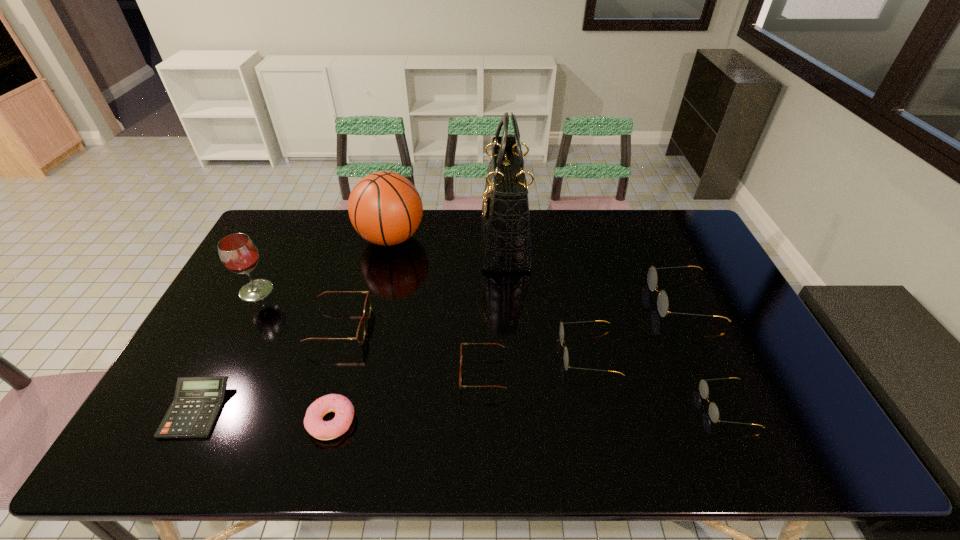
What are the coordinates of `handbag` in the screenshot? It's located at (505, 226).

Find the location of a particular element. the second tallest object is located at coordinates 385,208.

Where is `red wineglass`? This screenshot has height=540, width=960. red wineglass is located at coordinates (238, 253).

Where is `the third tallest object`? The width and height of the screenshot is (960, 540). the third tallest object is located at coordinates (238, 253).

The width and height of the screenshot is (960, 540). Identify the location of the biggest gold spectacles. (662, 301).

Locate an element on the screen. the fourth tallest object is located at coordinates (662, 301).

I want to click on the bigger brown spectacles, so 360,336.

This screenshot has width=960, height=540. What are the coordinates of `the leftmost spectacles` in the screenshot? It's located at 360,336.

Find the location of a particular element. The height and width of the screenshot is (540, 960). the leftmost gold spectacles is located at coordinates (561, 331).

Where is `the eighth object from left to right`? Image resolution: width=960 pixels, height=540 pixels. the eighth object from left to right is located at coordinates (561, 331).